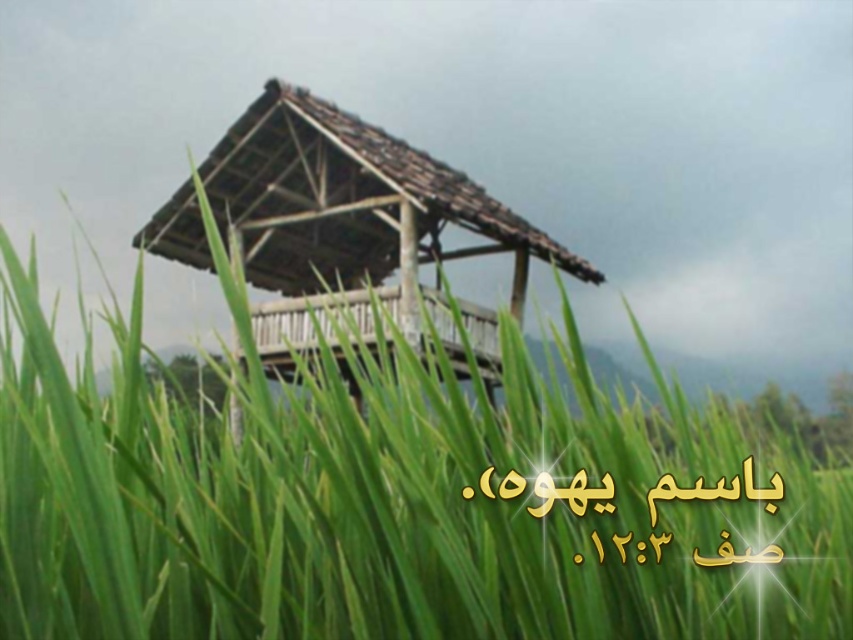
Question: Can you confirm if green grass at center is wider than wooden gazebo at center?

Choices:
 (A) no
 (B) yes

Answer: (B)

Question: Can you confirm if green grass at center is thinner than wooden gazebo at center?

Choices:
 (A) yes
 (B) no

Answer: (B)

Question: Among these points, which one is farthest from the camera?

Choices:
 (A) (595, 628)
 (B) (393, 179)

Answer: (B)

Question: Is green grass at center to the right of wooden gazebo at center from the viewer's perspective?

Choices:
 (A) no
 (B) yes

Answer: (B)